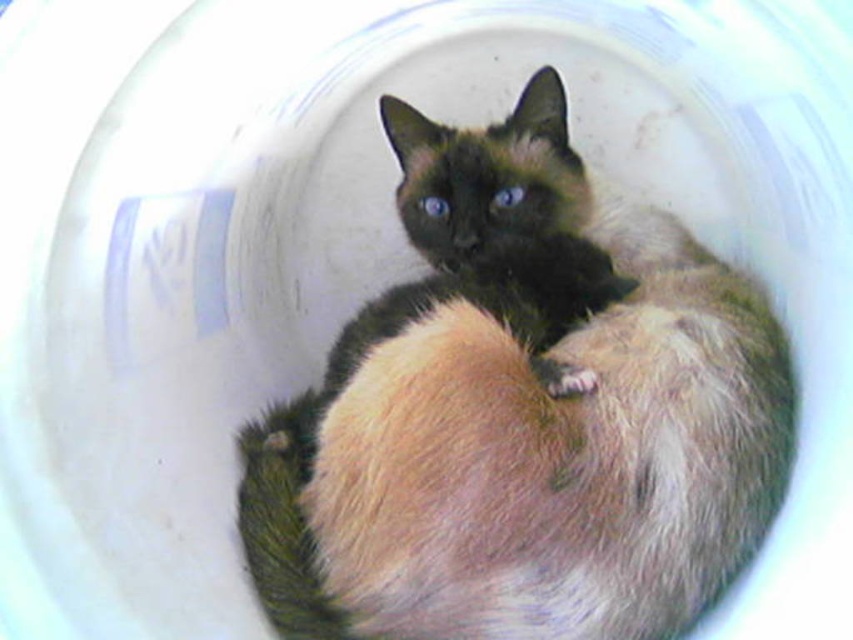
You are a pet owner who wants to place both the silky fur cat at center and the fuzzy fur paw at center into a new pet carrier. The carrier has a width of 1 meter. Can both animals fit side by side in the carrier without overlapping?

The silky fur cat at center might be wider than fuzzy fur paw at center, but since the carrier is 1 meter wide, it is possible they can fit together if the combined width of both animals does not exceed the carrier width. However, the exact dimensions are not provided, so this depends on their actual sizes.

You are a pet owner who wants to place a small toy inside the container. The toy is 10 cm in diameter. The silky fur cat at center and the fuzzy fur paw at center are both in the center. Which animal should you place the toy closer to to avoid disturbing them?

The silky fur cat at center is larger in size than the fuzzy fur paw at center, so placing the toy closer to the smaller fuzzy fur paw at center would be less likely to disturb the larger cat.